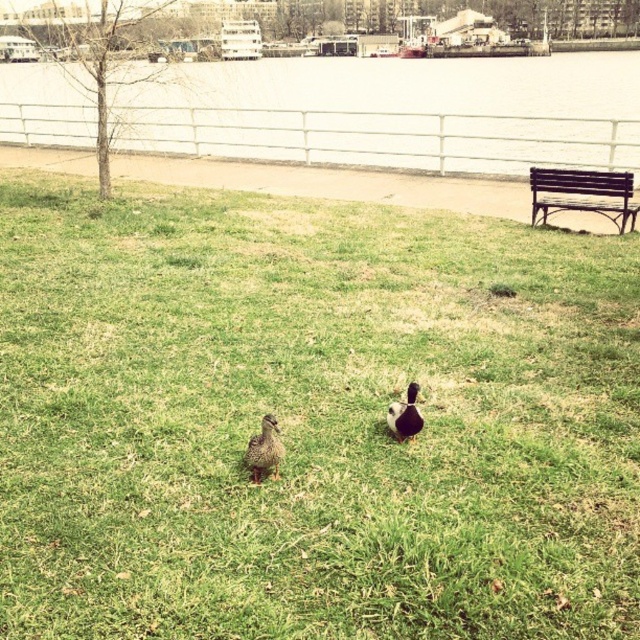
Who is lower down, green grassy at center or brown speckled feathers at center?

brown speckled feathers at center

Who is higher up, green grassy at center or brown speckled feathers at center?

green grassy at center is above.

The width and height of the screenshot is (640, 640). What do you see at coordinates (310, 420) in the screenshot? I see `green grassy at center` at bounding box center [310, 420].

Locate an element on the screen. This screenshot has width=640, height=640. green grassy at center is located at coordinates (310, 420).

Is point (275, 458) positioned in front of point (406, 416)?

Yes, point (275, 458) is closer to viewer.

Between brown speckled feathers at center and brown fuzzy duck at center, which one appears on the right side from the viewer's perspective?

brown fuzzy duck at center

Does point (250, 467) come closer to viewer compared to point (394, 403)?

Yes, it is in front of point (394, 403).

At what (x,y) coordinates should I click in order to perform the action: click on brown speckled feathers at center. Please return your answer as a coordinate pair (x, y). Looking at the image, I should click on (264, 449).

Who is more forward, (x=436, y=122) or (x=408, y=412)?

Positioned in front is point (x=408, y=412).

Does white metal fence at upper center have a larger size compared to brown fuzzy duck at center?

Indeed, white metal fence at upper center has a larger size compared to brown fuzzy duck at center.

At what (x,y) coordinates should I click in order to perform the action: click on white metal fence at upper center. Please return your answer as a coordinate pair (x, y). The height and width of the screenshot is (640, 640). Looking at the image, I should click on (381, 140).